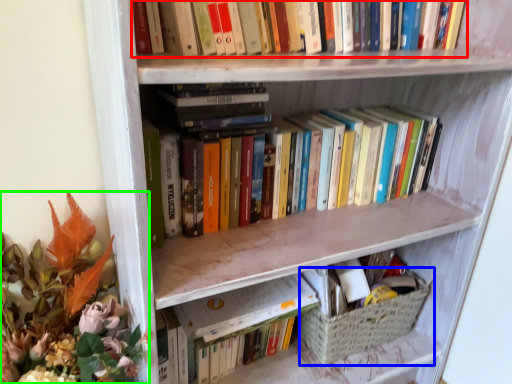
Question: Estimate the real-world distances between objects in this image. Which object is closer to book (highlighted by a red box), basket (highlighted by a blue box) or floral arrangement (highlighted by a green box)?

Choices:
 (A) basket
 (B) floral arrangement

Answer: (B)